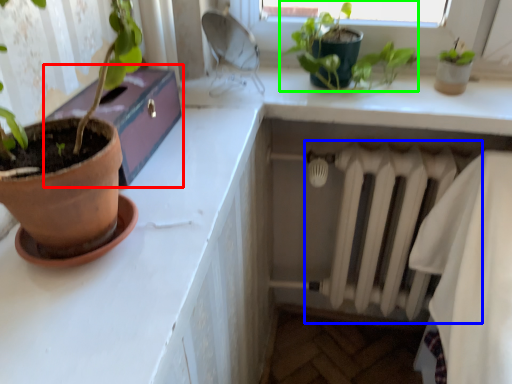
Question: Which object is positioned closest to window box (highlighted by a red box)? Select from radiator (highlighted by a blue box) and houseplant (highlighted by a green box).

Choices:
 (A) radiator
 (B) houseplant

Answer: (B)